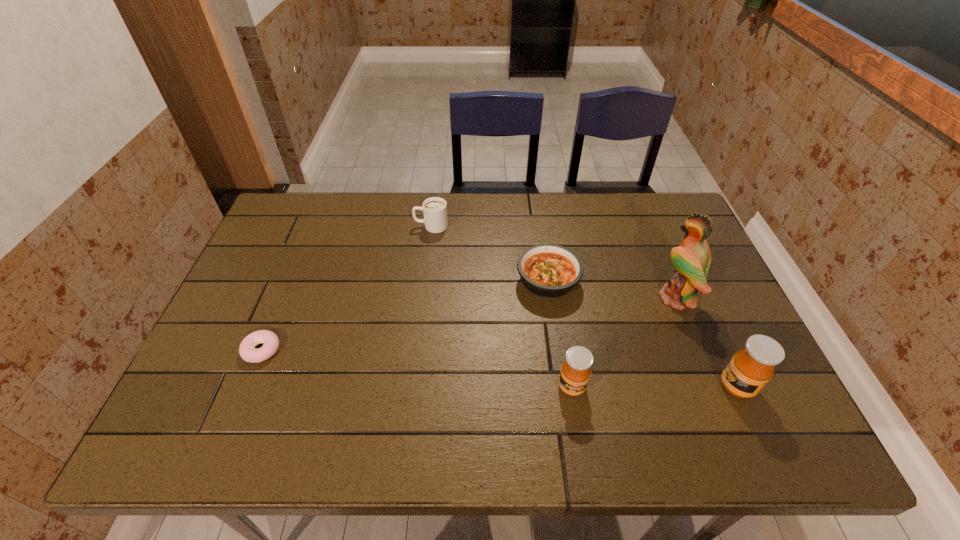
In order to click on vacant spot to place a honey on the left in this screenshot , I will do `click(406, 387)`.